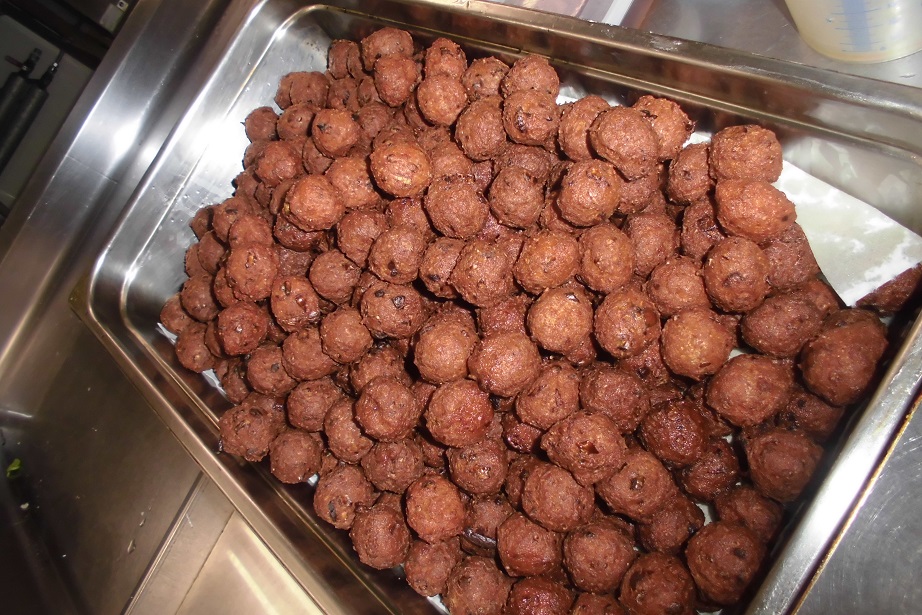
You are a GUI agent. You are given a task and a screenshot of the screen. Output one action in this format:
    pyautogui.click(x=<x>, y=<y>)
    Task: Click on the measuring cup
    The height and width of the screenshot is (615, 922).
    Given the screenshot: What is the action you would take?
    pyautogui.click(x=882, y=21)